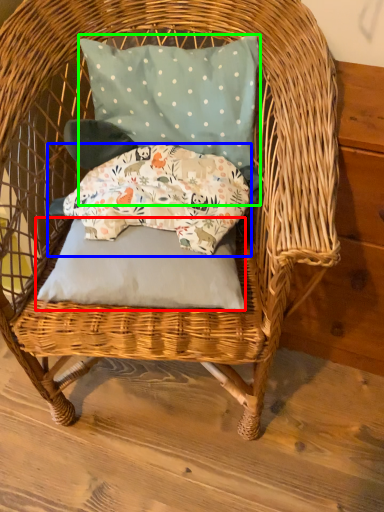
Question: Which object is positioned farthest from pillow (highlighted by a red box)? Select from pillow (highlighted by a blue box) and pillow (highlighted by a green box).

Choices:
 (A) pillow
 (B) pillow

Answer: (B)